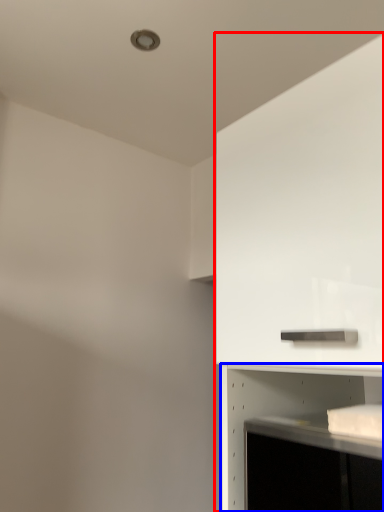
Question: Which of the following is the closest to the observer, cabinetry (highlighted by a red box) or shelf (highlighted by a blue box)?

Choices:
 (A) cabinetry
 (B) shelf

Answer: (A)